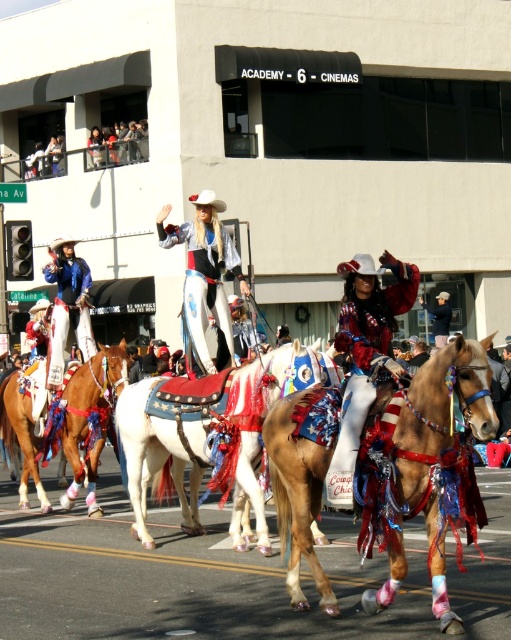
Question: Which point appears closest to the camera in this image?

Choices:
 (A) (229, 241)
 (B) (482, 340)

Answer: (B)

Question: Is shiny red boots at center bigger than shiny silver cowboy hat at center?

Choices:
 (A) no
 (B) yes

Answer: (A)

Question: Does light brown horse at center have a larger size compared to smooth leather hat at center?

Choices:
 (A) yes
 (B) no

Answer: (A)

Question: Among these objects, which one is farthest from the camera?

Choices:
 (A) light brown horse at center
 (B) shiny brown horse at center

Answer: (A)

Question: Which of the following is the closest to the observer?

Choices:
 (A) brown glossy horse at center
 (B) shiny silver cowboy hat at center
 (C) matte blue jacket at left
 (D) light brown horse at center

Answer: (D)

Question: Is the position of shiny brown horse at center more distant than that of shiny red boots at center?

Choices:
 (A) no
 (B) yes

Answer: (A)